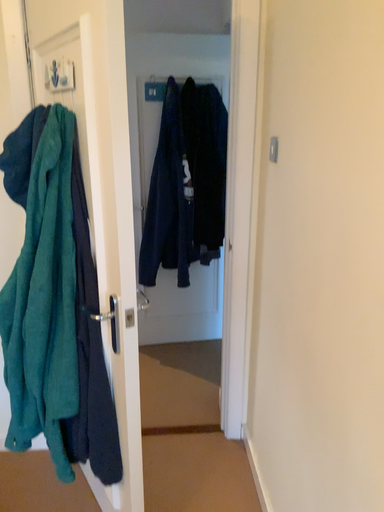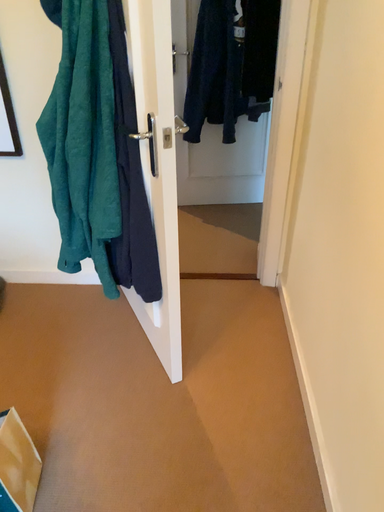
Question: Which way did the camera rotate in the video?

Choices:
 (A) rotated upward
 (B) rotated downward

Answer: (B)